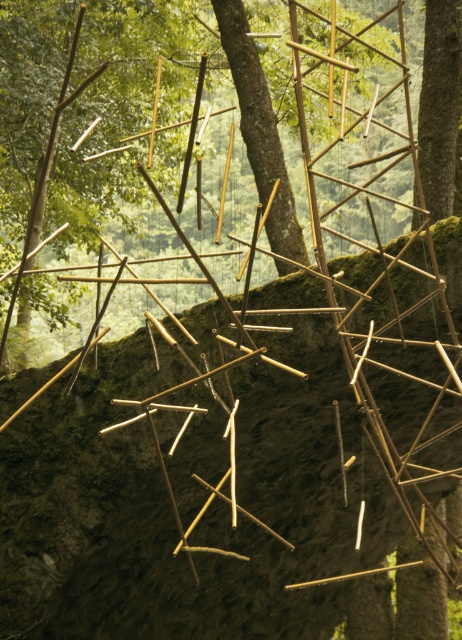
You are standing in front of the bamboo structure and want to touch both the brown rough tree trunk at center and the brown rough tree trunk at upper right. Which one should you reach for first to touch the closer one?

You should reach for the brown rough tree trunk at center first because it is closer to the viewer than the brown rough tree trunk at upper right.